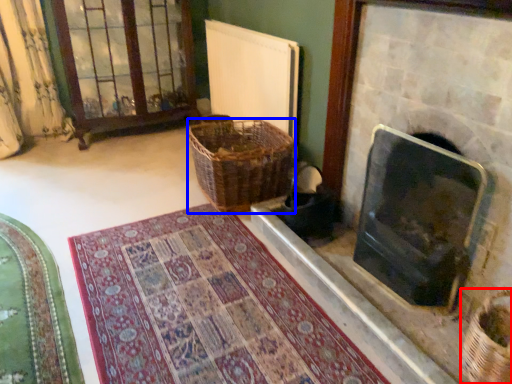
Question: Which point is further to the camera, basket (highlighted by a red box) or basket (highlighted by a blue box)?

Choices:
 (A) basket
 (B) basket

Answer: (B)